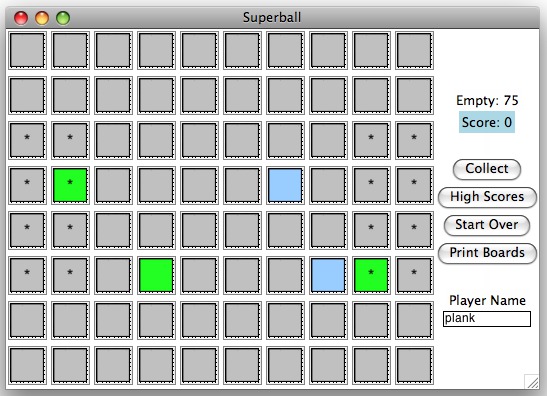
The width and height of the screenshot is (547, 396). I want to click on red circular 'light', so click(19, 21).